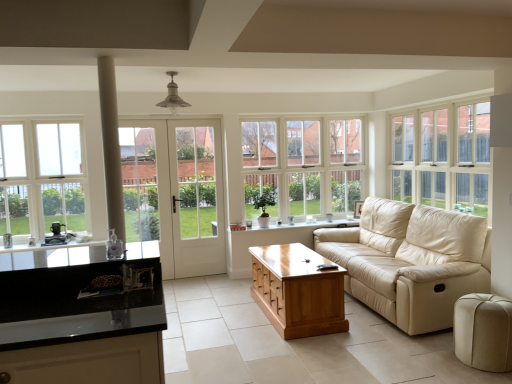
Question: From the image's perspective, is beige velvet ottoman at lower right above or below shiny brown wooden coffee table at center?

Choices:
 (A) above
 (B) below

Answer: (B)

Question: Is beige velvet ottoman at lower right wider or thinner than shiny brown wooden coffee table at center?

Choices:
 (A) thin
 (B) wide

Answer: (A)

Question: Estimate the real-world distances between objects in this image. Which object is farther from the beige velvet ottoman at lower right?

Choices:
 (A) black glossy countertop at lower left
 (B) white glass window at left, positioned as the 3th window in right-to-left order
 (C) white wood window at center, which is the second window from left to right
 (D) white glass door at center
 (E) white wood window at upper right, arranged as the third window when viewed from the left

Answer: (B)

Question: Estimate the real-world distances between objects in this image. Which object is closer to the white wood window at upper right, acting as the 1th window starting from the right?

Choices:
 (A) shiny brown wooden coffee table at center
 (B) beige velvet ottoman at lower right
 (C) beige leather couch at center
 (D) black glossy countertop at lower left
 (E) white wood window at center, which is the second window from left to right

Answer: (C)